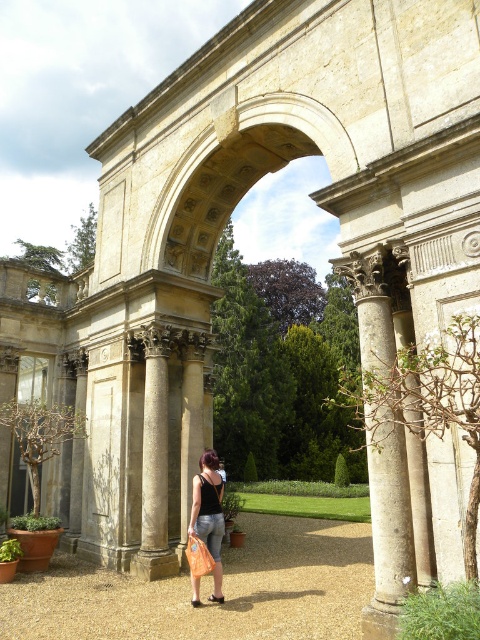
Question: Does gravel path at center have a smaller size compared to stone textured archway at center?

Choices:
 (A) no
 (B) yes

Answer: (A)

Question: Estimate the real-world distances between objects in this image. Which object is farther from the smooth stone column at center?

Choices:
 (A) black denim jeans at center
 (B) stone textured archway at center
 (C) gravel path at center

Answer: (B)

Question: Does gravel path at center appear under smooth stone column at center?

Choices:
 (A) no
 (B) yes

Answer: (B)

Question: Among these objects, which one is nearest to the camera?

Choices:
 (A) stone textured archway at center
 (B) smooth stone column at center

Answer: (A)

Question: Which point is closer to the camera taking this photo?

Choices:
 (A) (217, 560)
 (B) (155, 465)
 (C) (328, 163)

Answer: (C)

Question: From the image, what is the correct spatial relationship of stone textured archway at center in relation to black denim jeans at center?

Choices:
 (A) below
 (B) above

Answer: (B)